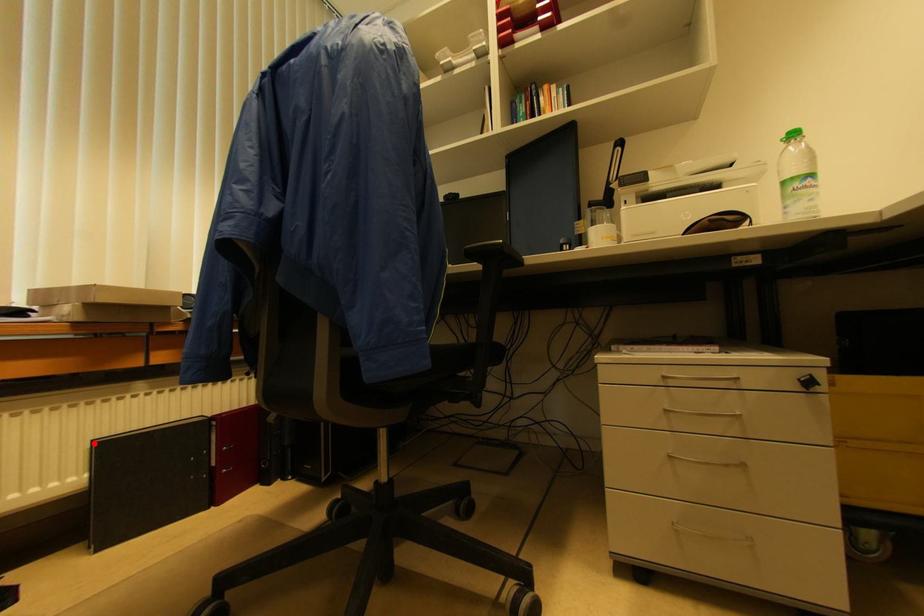
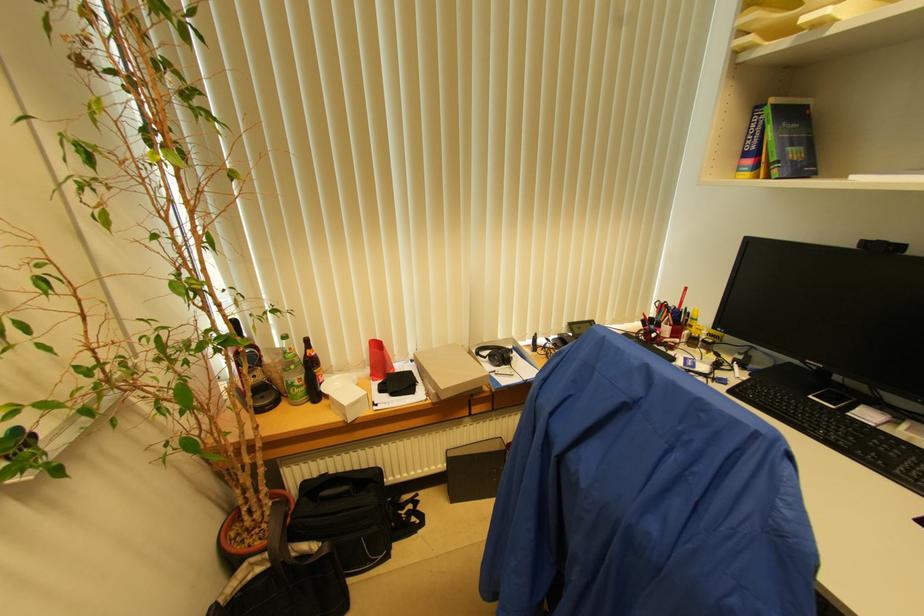
Question: I am providing you with two images of the same scene from different viewpoints. A red point is shown in image1. For the corresponding object point in image2, is it positioned nearer or farther from the camera?

Choices:
 (A) Nearer
 (B) Farther

Answer: (B)